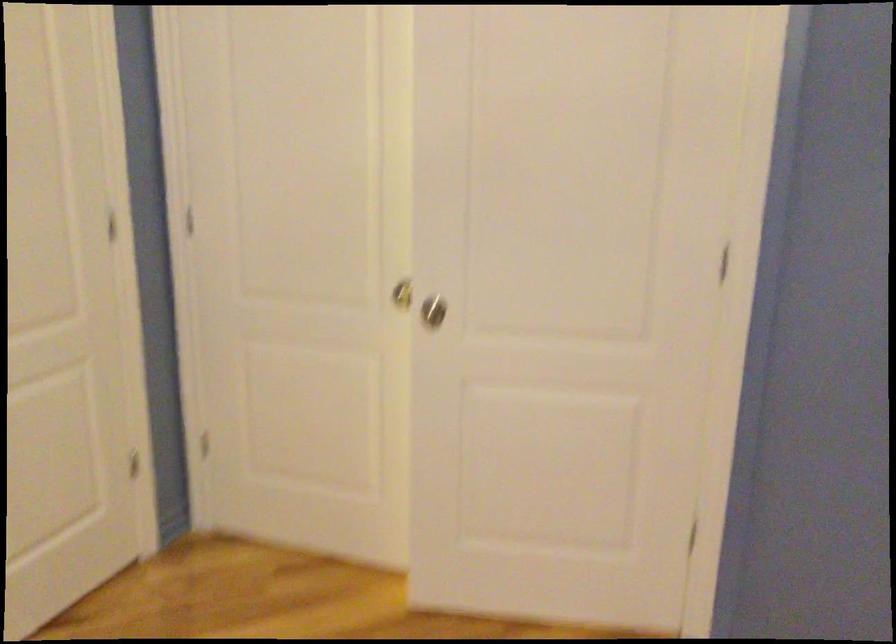
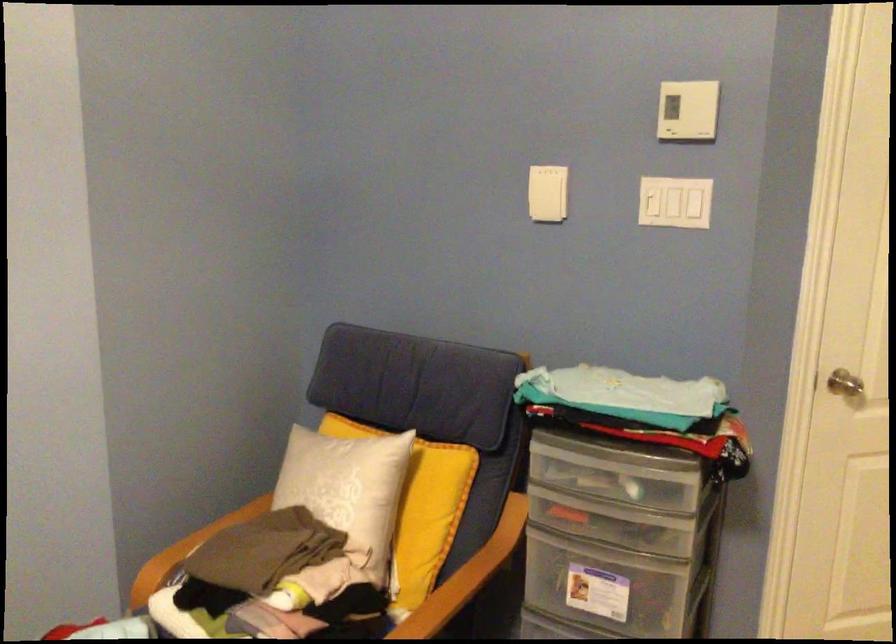
Question: The camera is either moving clockwise (left) or counter-clockwise (right) around the object. The first image is from the beginning of the video and the second image is from the end. Is the camera moving left or right when shooting the video?

Choices:
 (A) Left
 (B) Right

Answer: (B)